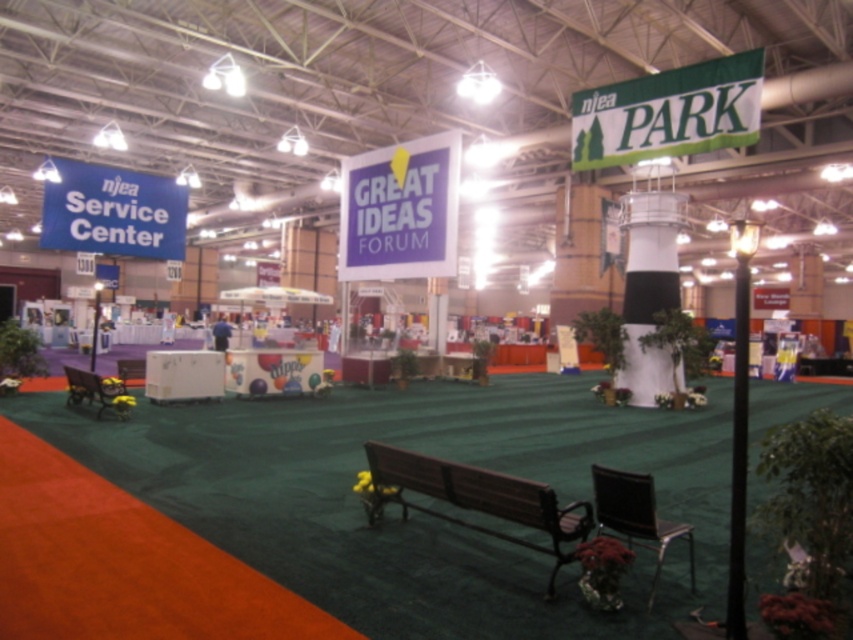
You are attending a conference and want to sit down. You see a purple paper sign at center and a wooden bench at center. Which one is closer to you?

The purple paper sign at center is closer to you because the wooden bench at center is behind it.